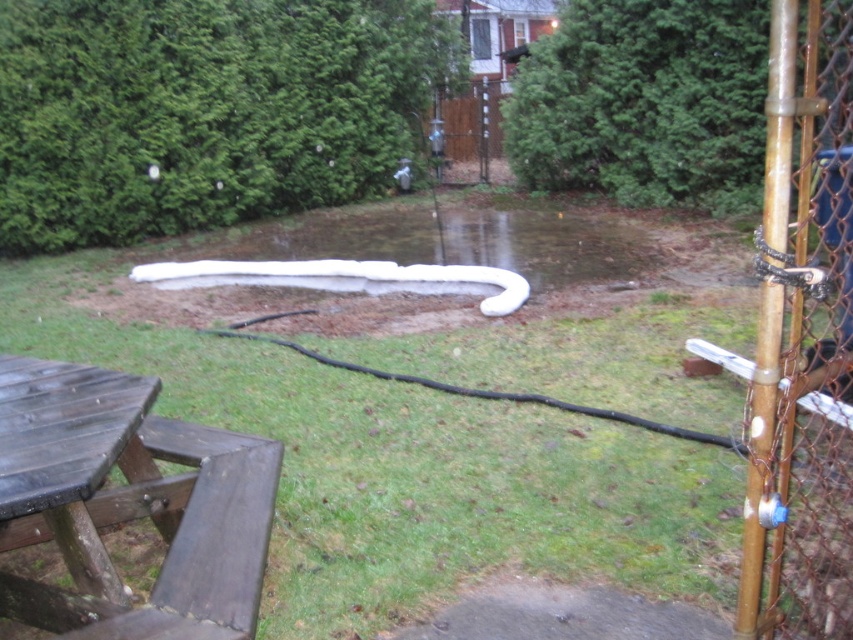
You are standing in the backyard and see the point at coordinates (128,504). Which object is this point located on?

The point at coordinates (128,504) is located on the dark brown wood picnic table at lower left.